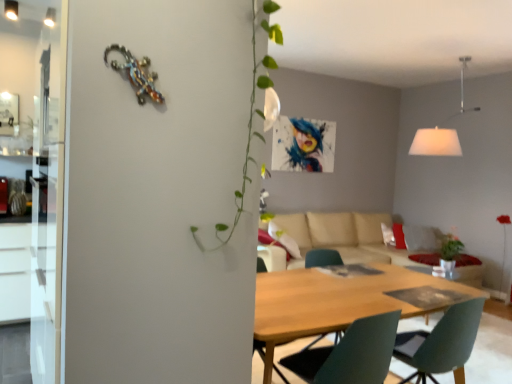
Question: Can you confirm if white fabric lampshade at upper right is smaller than matte green chair at center?

Choices:
 (A) yes
 (B) no

Answer: (B)

Question: Considering the relative sizes of white fabric lampshade at upper right and matte green chair at center in the image provided, is white fabric lampshade at upper right shorter than matte green chair at center?

Choices:
 (A) yes
 (B) no

Answer: (B)

Question: Can you confirm if white fabric lampshade at upper right is thinner than matte green chair at center?

Choices:
 (A) yes
 (B) no

Answer: (B)

Question: Does white fabric lampshade at upper right have a greater height compared to matte green chair at center?

Choices:
 (A) yes
 (B) no

Answer: (A)

Question: Can you confirm if white fabric lampshade at upper right is positioned to the left of matte green chair at center?

Choices:
 (A) no
 (B) yes

Answer: (A)

Question: Considering the relative sizes of white fabric lampshade at upper right and matte green chair at center in the image provided, is white fabric lampshade at upper right wider than matte green chair at center?

Choices:
 (A) yes
 (B) no

Answer: (A)

Question: Is matte green chair at center facing towards beige fabric couch at center?

Choices:
 (A) yes
 (B) no

Answer: (B)

Question: Does matte green chair at center contain beige fabric couch at center?

Choices:
 (A) yes
 (B) no

Answer: (B)

Question: Is the surface of matte green chair at center in direct contact with beige fabric couch at center?

Choices:
 (A) no
 (B) yes

Answer: (A)

Question: From the image's perspective, is matte green chair at center over beige fabric couch at center?

Choices:
 (A) yes
 (B) no

Answer: (B)

Question: From the image's perspective, is matte green chair at center located beneath beige fabric couch at center?

Choices:
 (A) yes
 (B) no

Answer: (A)

Question: Is matte green chair at center thinner than beige fabric couch at center?

Choices:
 (A) yes
 (B) no

Answer: (A)

Question: Is the depth of wooden table at center greater than that of white fabric lampshade at upper right?

Choices:
 (A) no
 (B) yes

Answer: (A)